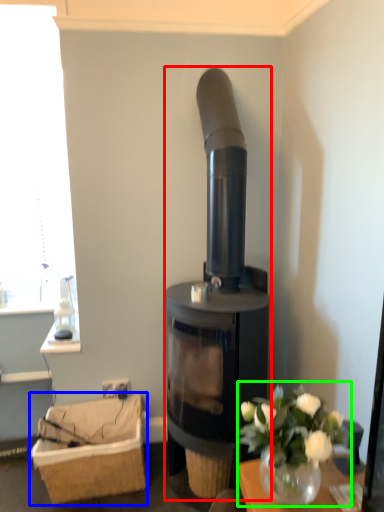
Question: Based on their relative distances, which object is farther from wood burning stove (highlighted by a red box)? Choose from basket (highlighted by a blue box) and floral arrangement (highlighted by a green box).

Choices:
 (A) basket
 (B) floral arrangement

Answer: (B)